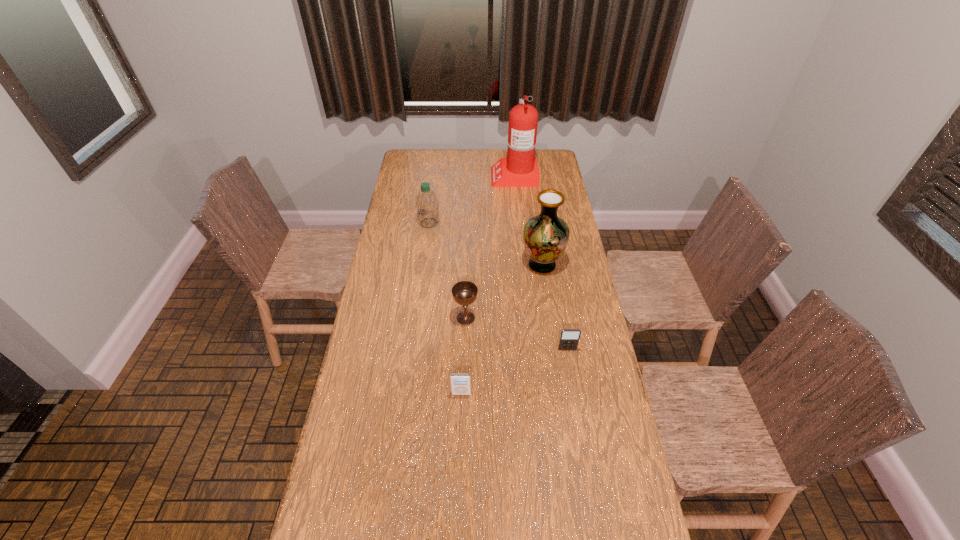
Where is `the left iPod`? the left iPod is located at coordinates (460, 383).

The width and height of the screenshot is (960, 540). Identify the location of the nearest object. (460, 383).

The height and width of the screenshot is (540, 960). I want to click on vacant area situated on the front-facing side of the fire extinguisher, so (424, 176).

Locate an element on the screen. The height and width of the screenshot is (540, 960). blank area located on the front-facing side of the fire extinguisher is located at coordinates (468, 176).

The width and height of the screenshot is (960, 540). I want to click on free space located 0.220m on the front-facing side of the fire extinguisher, so click(x=449, y=176).

In order to click on vacant space located 0.170m on the front of the fourth nearest object in this screenshot , I will do `click(549, 313)`.

Image resolution: width=960 pixels, height=540 pixels. What are the coordinates of `free space located 0.320m on the right of the fifth nearest object` in the screenshot? It's located at (510, 223).

Identify the location of vacant point located on the right of the third shortest object. Image resolution: width=960 pixels, height=540 pixels. (513, 318).

Locate an element on the screen. This screenshot has width=960, height=540. vacant space situated 0.320m on the front-facing side of the farther iPod is located at coordinates (583, 440).

Locate an element on the screen. This screenshot has width=960, height=540. vacant area situated 0.150m on the front-facing side of the left iPod is located at coordinates (460, 441).